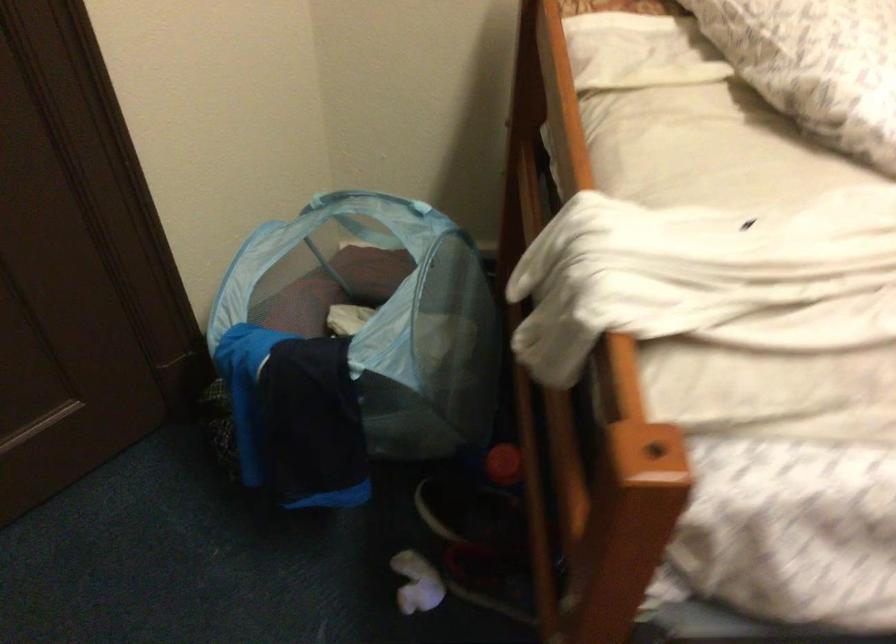
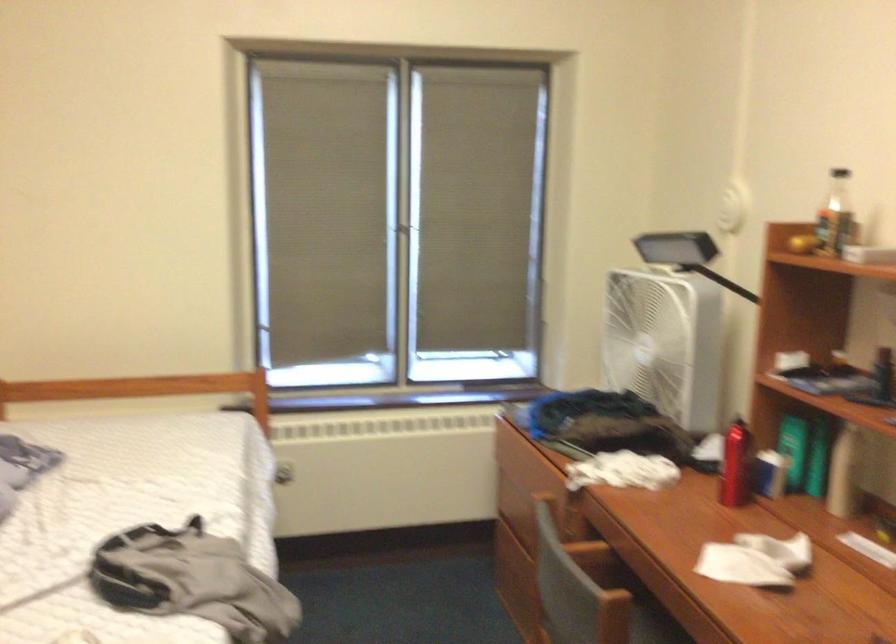
How did the camera likely rotate?

The camera's rotation is toward right-down.